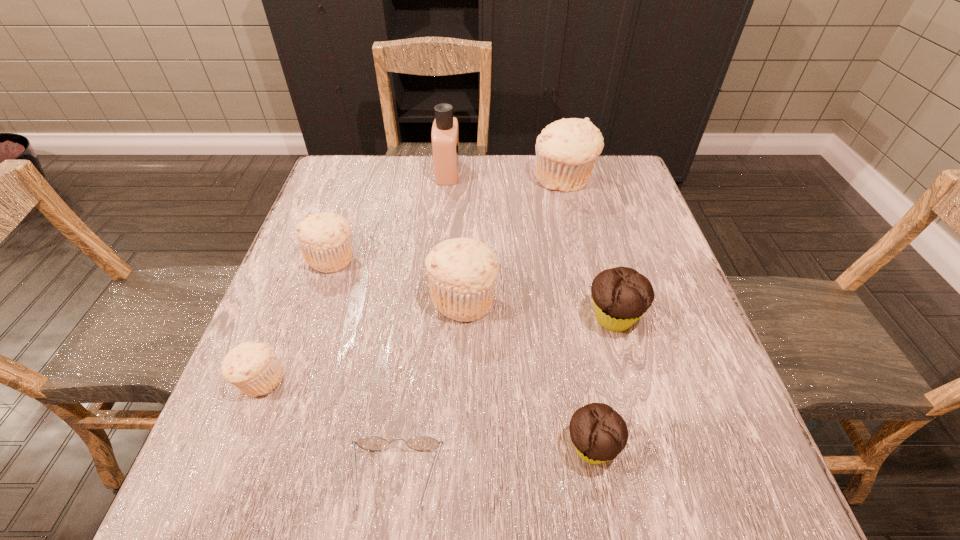
In the image, there is a desktop. Where is `free space at the far right corner`? free space at the far right corner is located at coordinates pyautogui.click(x=610, y=173).

Where is `vacant point located between the farther chocolate muffin and the fifth farthest muffin`? The image size is (960, 540). vacant point located between the farther chocolate muffin and the fifth farthest muffin is located at coordinates (437, 349).

Find the location of a particular element. This screenshot has height=540, width=960. free space between the third biggest beige muffin and the perfume is located at coordinates (390, 214).

Locate an element on the screen. This screenshot has height=540, width=960. free spot between the farther chocolate muffin and the nearer chocolate muffin is located at coordinates (603, 382).

At what (x,y) coordinates should I click in order to perform the action: click on unoccupied position between the third beige muffin from left to right and the nearest beige muffin. Please return your answer as a coordinate pair (x, y). Looking at the image, I should click on (362, 339).

Where is `free space that is in between the bigger chocolate muffin and the fifth shortest muffin`? This screenshot has height=540, width=960. free space that is in between the bigger chocolate muffin and the fifth shortest muffin is located at coordinates (539, 308).

Where is `free space that is in between the second beige muffin from right to left and the tallest muffin`? This screenshot has width=960, height=540. free space that is in between the second beige muffin from right to left and the tallest muffin is located at coordinates click(x=514, y=239).

Locate an element on the screen. The height and width of the screenshot is (540, 960). free space that is in between the spectacles and the bigger chocolate muffin is located at coordinates (505, 399).

This screenshot has width=960, height=540. I want to click on free space between the perfume and the sixth shortest object, so click(456, 235).

You are a GUI agent. You are given a task and a screenshot of the screen. Output one action in this format:
    pyautogui.click(x=<x>, y=<y>)
    Task: Click on the vacant area between the perfume and the third biggest beige muffin
    This screenshot has width=960, height=540.
    Given the screenshot: What is the action you would take?
    pyautogui.click(x=390, y=214)